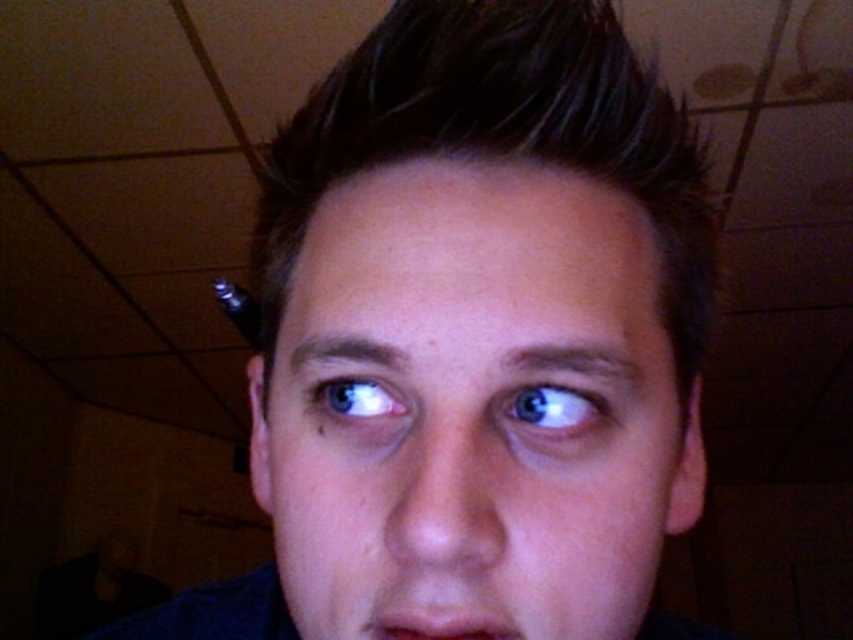
Question: Which point is farther from the camera taking this photo?

Choices:
 (A) (583, 115)
 (B) (583, 198)
 (C) (537, 412)
 (D) (392, 620)

Answer: (A)

Question: Which of the following is the closest to the observer?

Choices:
 (A) blue glossy eye at upper center
 (B) matte skin mouth at center
 (C) dark brown shiny hair at center
 (D) smooth skin face at center

Answer: (D)

Question: Does smooth skin face at center have a greater width compared to matte skin mouth at center?

Choices:
 (A) yes
 (B) no

Answer: (A)

Question: Observing the image, what is the correct spatial positioning of smooth skin face at center in reference to blue glossy eye at center?

Choices:
 (A) right
 (B) left

Answer: (A)

Question: Is dark brown shiny hair at center wider than blue glossy eye at center?

Choices:
 (A) yes
 (B) no

Answer: (A)

Question: Which point appears closest to the camera in this image?

Choices:
 (A) tap(529, 417)
 (B) tap(585, 154)

Answer: (A)